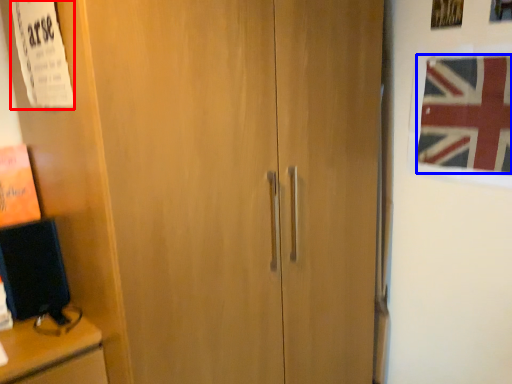
Question: Which object is further to the camera taking this photo, poster (highlighted by a red box) or flag (highlighted by a blue box)?

Choices:
 (A) poster
 (B) flag

Answer: (B)